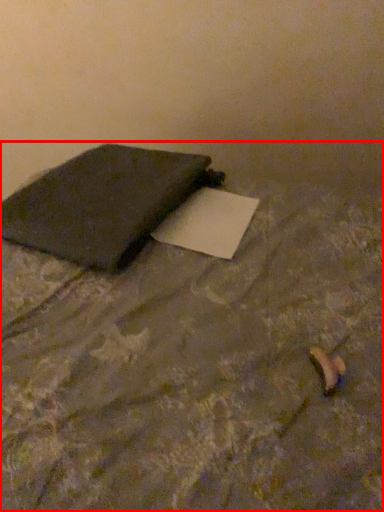
Question: From the image's perspective, what is the correct spatial positioning of furniture (annotated by the red box) in reference to notebook?

Choices:
 (A) below
 (B) above

Answer: (A)